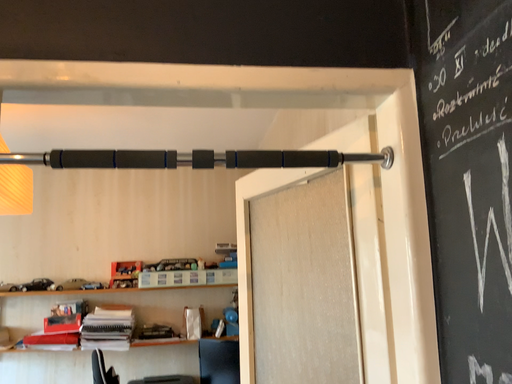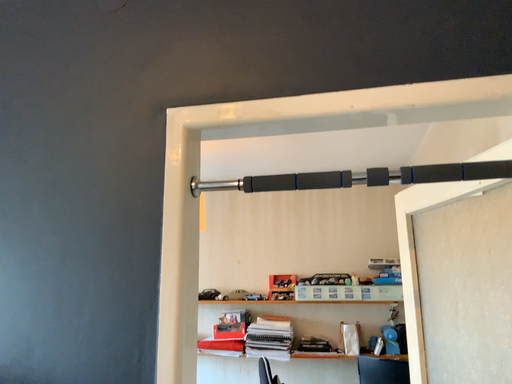
Question: Which way did the camera rotate in the video?

Choices:
 (A) rotated left
 (B) rotated right

Answer: (A)